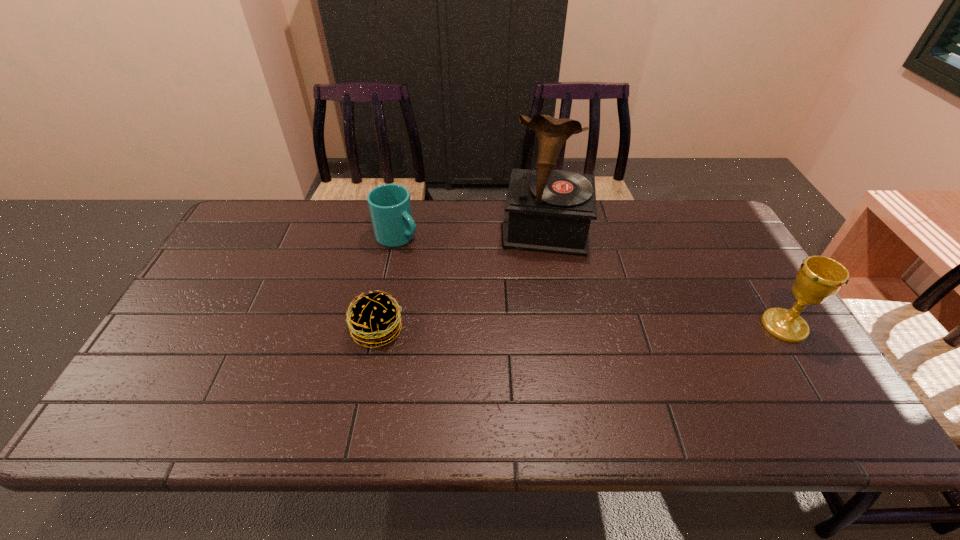
Where is `vacant space on the desktop that is between the patty and the rightmost object and is positioned at the horn opening of the tallest object`? This screenshot has width=960, height=540. vacant space on the desktop that is between the patty and the rightmost object and is positioned at the horn opening of the tallest object is located at coordinates (540, 328).

Where is `vacant space on the desktop that is between the shortest object and the second tallest object and is positioned on the handle side of the second shortest object`? vacant space on the desktop that is between the shortest object and the second tallest object and is positioned on the handle side of the second shortest object is located at coordinates (545, 328).